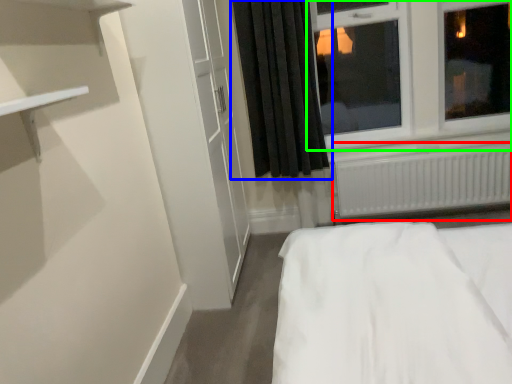
Question: Which object is the farthest from radiator (highlighted by a red box)? Choose among these: curtain (highlighted by a blue box) or window (highlighted by a green box).

Choices:
 (A) curtain
 (B) window

Answer: (A)